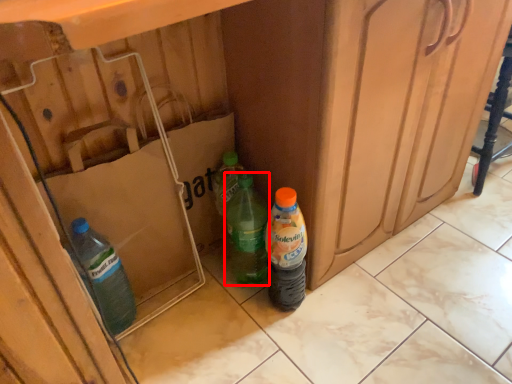
Question: From the image's perspective, where is bottle (annotated by the red box) located relative to bottle?

Choices:
 (A) below
 (B) above

Answer: (B)